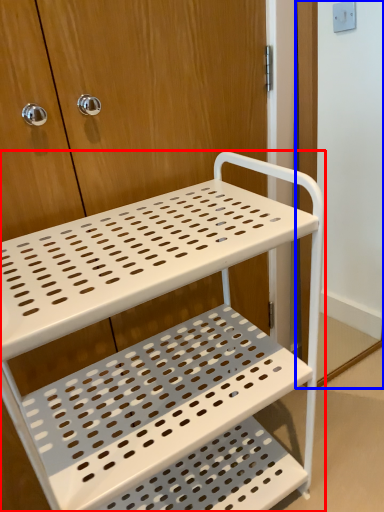
Question: Which object appears farthest to the camera in this image, furniture (highlighted by a red box) or screen door (highlighted by a blue box)?

Choices:
 (A) furniture
 (B) screen door

Answer: (B)